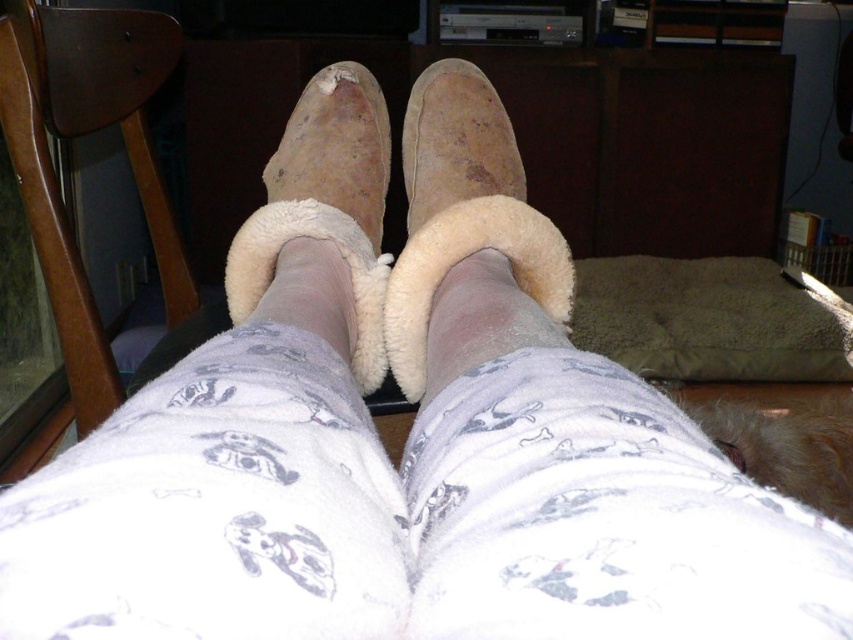
Which is above, fuzzy white socks at center or suede/sheepskin boot at center?

suede/sheepskin boot at center is higher up.

Is fuzzy white socks at center closer to camera compared to suede/sheepskin boot at center?

Yes, fuzzy white socks at center is closer to the viewer.

Between point (328, 106) and point (529, 273), which one is positioned behind?

Point (328, 106)

Where is `fuzzy white socks at center`? Image resolution: width=853 pixels, height=640 pixels. fuzzy white socks at center is located at coordinates (241, 438).

Is point (49, 45) more distant than point (462, 161)?

Yes.

Who is more distant from viewer, (33, 120) or (541, 253)?

Point (33, 120)

Who is more distant from viewer, (10,120) or (517,150)?

Point (10,120)

Image resolution: width=853 pixels, height=640 pixels. Find the location of `brown wood chair at left`. brown wood chair at left is located at coordinates (80, 134).

Between brown wood chair at left and suede-like tan boot at center, which one has more height?

With more height is brown wood chair at left.

Does brown wood chair at left appear under suede-like tan boot at center?

Incorrect, brown wood chair at left is not positioned below suede-like tan boot at center.

Is point (9, 61) behind point (310, 186)?

Yes, it is behind point (310, 186).

At what (x,y) coordinates should I click in order to perform the action: click on brown wood chair at left. Please return your answer as a coordinate pair (x, y). The height and width of the screenshot is (640, 853). Looking at the image, I should click on (80, 134).